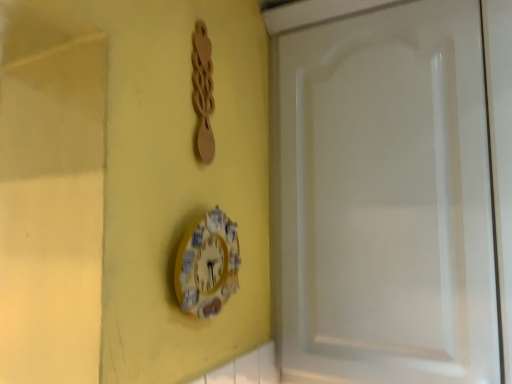
The height and width of the screenshot is (384, 512). What do you see at coordinates (207, 265) in the screenshot? I see `yellow painted wood clock at center` at bounding box center [207, 265].

Locate an element on the screen. This screenshot has height=384, width=512. yellow painted wood clock at center is located at coordinates (207, 265).

Describe the element at coordinates (387, 199) in the screenshot. I see `white glossy cabinet door at right` at that location.

This screenshot has height=384, width=512. I want to click on white glossy cabinet door at right, so click(387, 199).

This screenshot has height=384, width=512. Identify the location of yellow painted wood clock at center. (207, 265).

Looking at this image, considering the positions of objects white glossy cabinet door at right and yellow painted wood clock at center in the image provided, who is more to the right, white glossy cabinet door at right or yellow painted wood clock at center?

white glossy cabinet door at right.

Considering the positions of objects white glossy cabinet door at right and yellow painted wood clock at center in the image provided, who is behind, white glossy cabinet door at right or yellow painted wood clock at center?

white glossy cabinet door at right is behind.

Considering the positions of points (321, 342) and (196, 309), is point (321, 342) farther from camera compared to point (196, 309)?

Yes, point (321, 342) is behind point (196, 309).

In the scene shown: From the image's perspective, is white glossy cabinet door at right positioned above or below yellow painted wood clock at center?

white glossy cabinet door at right is above yellow painted wood clock at center.

From a real-world perspective, is white glossy cabinet door at right located higher than yellow painted wood clock at center?

Yes, from a real-world perspective, white glossy cabinet door at right is over yellow painted wood clock at center

Is white glossy cabinet door at right thinner than yellow painted wood clock at center?

In fact, white glossy cabinet door at right might be wider than yellow painted wood clock at center.

Who is taller, white glossy cabinet door at right or yellow painted wood clock at center?

With more height is white glossy cabinet door at right.

Does white glossy cabinet door at right have a larger size compared to yellow painted wood clock at center?

Indeed, white glossy cabinet door at right has a larger size compared to yellow painted wood clock at center.

Is yellow painted wood clock at center located within white glossy cabinet door at right?

No.

Would you say white glossy cabinet door at right is a long distance from yellow painted wood clock at center?

That's not correct — white glossy cabinet door at right is a little close to yellow painted wood clock at center.

Is white glossy cabinet door at right looking in the opposite direction of yellow painted wood clock at center?

That's not correct — white glossy cabinet door at right is not looking away from yellow painted wood clock at center.

What's the angular difference between white glossy cabinet door at right and yellow painted wood clock at center's facing directions?

Result: 90.7 degrees.

The width and height of the screenshot is (512, 384). In the image, there is a white glossy cabinet door at right. What are the coordinates of `wall clock below it (from the image's perspective)` in the screenshot? It's located at [207, 265].

Is yellow painted wood clock at center to the left or to the right of white glossy cabinet door at right in the image?

yellow painted wood clock at center is to the left of white glossy cabinet door at right.

Is the depth of yellow painted wood clock at center greater than that of white glossy cabinet door at right?

No, yellow painted wood clock at center is in front of white glossy cabinet door at right.

Is point (200, 264) less distant than point (372, 219)?

Yes, point (200, 264) is in front of point (372, 219).

From the image's perspective, which is below, yellow painted wood clock at center or white glossy cabinet door at right?

yellow painted wood clock at center appears lower in the image.

From a real-world perspective, between yellow painted wood clock at center and white glossy cabinet door at right, who is vertically lower?

yellow painted wood clock at center.

Which of these two, yellow painted wood clock at center or white glossy cabinet door at right, is thinner?

With smaller width is yellow painted wood clock at center.

Who is shorter, yellow painted wood clock at center or white glossy cabinet door at right?

Standing shorter between the two is yellow painted wood clock at center.

Is yellow painted wood clock at center bigger than white glossy cabinet door at right?

Actually, yellow painted wood clock at center might be smaller than white glossy cabinet door at right.

Does yellow painted wood clock at center contain white glossy cabinet door at right?

Actually, white glossy cabinet door at right is outside yellow painted wood clock at center.

Would you say yellow painted wood clock at center is a long distance from white glossy cabinet door at right?

yellow painted wood clock at center is actually quite close to white glossy cabinet door at right.

Is yellow painted wood clock at center turned away from white glossy cabinet door at right?

No, yellow painted wood clock at center is not facing away from white glossy cabinet door at right.

Can you tell me how much yellow painted wood clock at center and white glossy cabinet door at right differ in facing direction?

90.7 degrees.

Consider the image. Measure the distance from yellow painted wood clock at center to white glossy cabinet door at right.

yellow painted wood clock at center is 15.19 inches from white glossy cabinet door at right.

Identify the location of screen door above the yellow painted wood clock at center (from the image's perspective). This screenshot has height=384, width=512. (387, 199).

Where is `wall clock below the white glossy cabinet door at right (from a real-world perspective)`? wall clock below the white glossy cabinet door at right (from a real-world perspective) is located at coordinates (207, 265).

Find the location of a particular element. The width and height of the screenshot is (512, 384). screen door above the yellow painted wood clock at center (from a real-world perspective) is located at coordinates point(387,199).